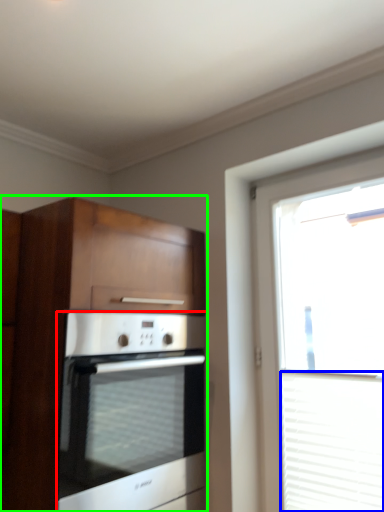
Question: Estimate the real-world distances between objects in this image. Which object is farther from oven (highlighted by a red box), blind (highlighted by a blue box) or cabinetry (highlighted by a green box)?

Choices:
 (A) blind
 (B) cabinetry

Answer: (A)